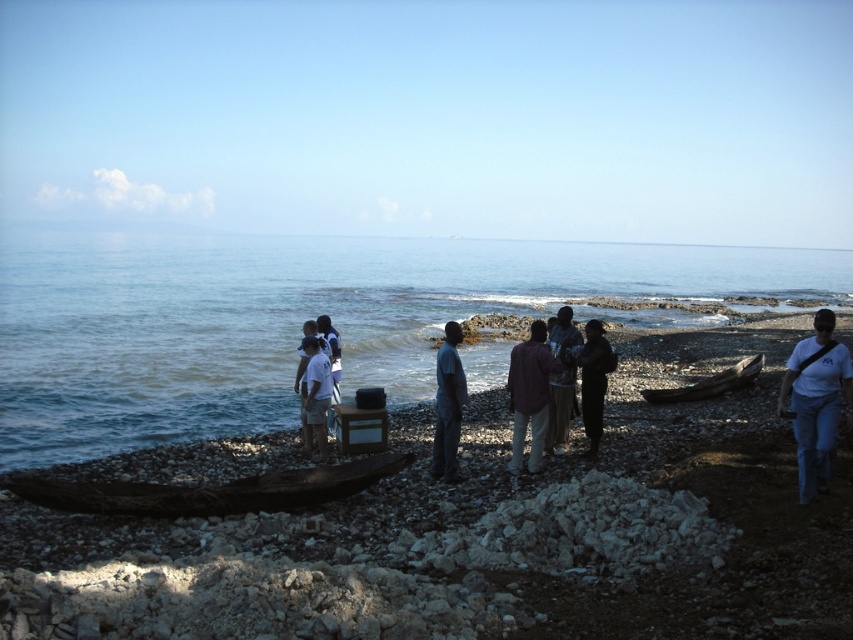
Question: Does dark blue fabric at center have a lesser width compared to dark brown leather jacket at center?

Choices:
 (A) yes
 (B) no

Answer: (B)

Question: Observing the image, what is the correct spatial positioning of white cotton shirt at lower right in reference to brown wooden boat at lower right?

Choices:
 (A) below
 (B) above

Answer: (B)

Question: Is the position of smooth pebbles at center more distant than that of brown wooden boat at lower right?

Choices:
 (A) no
 (B) yes

Answer: (A)

Question: Which of the following is the closest to the observer?

Choices:
 (A) (6, 576)
 (B) (337, 369)
 (C) (264, 250)

Answer: (A)

Question: Which object is farther from the camera taking this photo?

Choices:
 (A) plaid fabric shirt at center
 (B) dark blue fabric at center
 (C) white cotton shirt at lower right
 (D) brown wooden boat at lower right

Answer: (D)

Question: Which point is closer to the camera?

Choices:
 (A) (550, 369)
 (B) (596, 624)

Answer: (B)